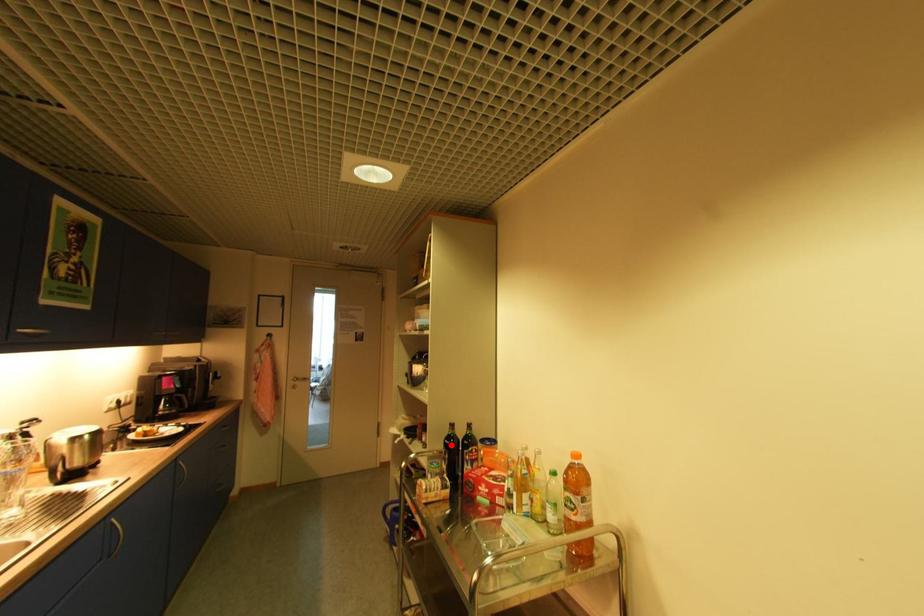
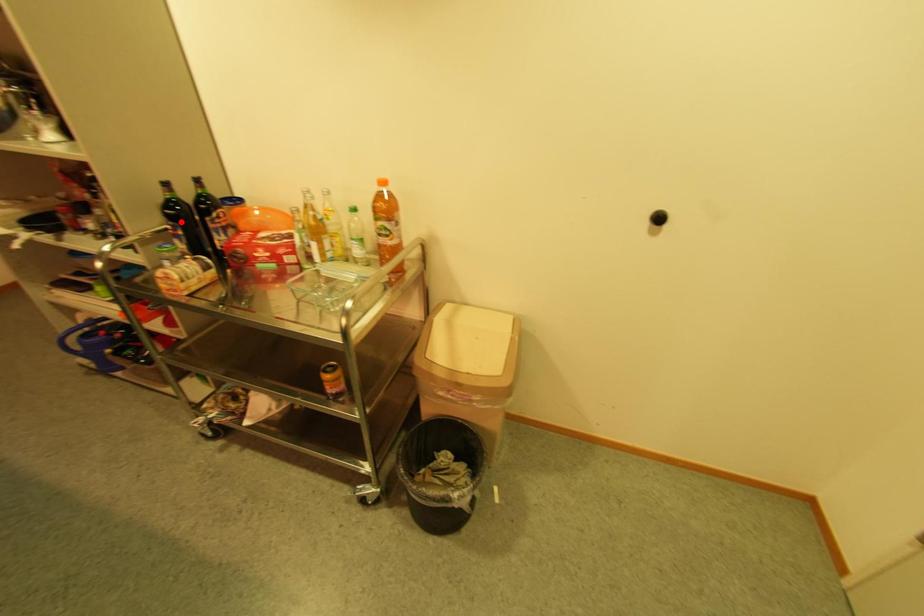
I am providing you with two images of the same scene from different viewpoints. A red point is marked on the first image and another point is marked on the second image. Is the marked point in image1 the same physical position as the marked point in image2?

No